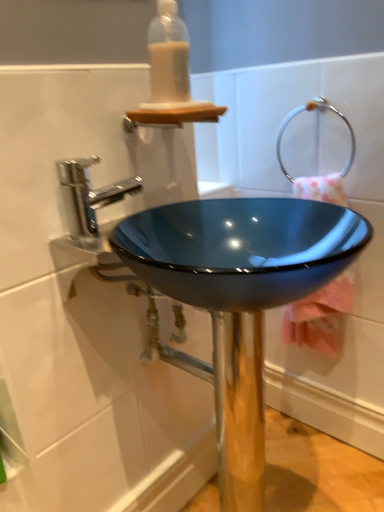
Question: Considering the relative sizes of translucent plastic bottle at upper center and glossy blue bowl at center in the image provided, is translucent plastic bottle at upper center thinner than glossy blue bowl at center?

Choices:
 (A) no
 (B) yes

Answer: (B)

Question: From the image's perspective, is translucent plastic bottle at upper center on glossy blue bowl at center?

Choices:
 (A) yes
 (B) no

Answer: (A)

Question: Would you say translucent plastic bottle at upper center is outside glossy blue bowl at center?

Choices:
 (A) yes
 (B) no

Answer: (A)

Question: Is translucent plastic bottle at upper center oriented towards glossy blue bowl at center?

Choices:
 (A) yes
 (B) no

Answer: (B)

Question: Considering the relative positions of translucent plastic bottle at upper center and glossy blue bowl at center in the image provided, is translucent plastic bottle at upper center to the right of glossy blue bowl at center from the viewer's perspective?

Choices:
 (A) yes
 (B) no

Answer: (B)

Question: From a real-world perspective, relative to polished chrome faucet at upper left, is glossy blue bowl at center vertically above or below?

Choices:
 (A) below
 (B) above

Answer: (A)

Question: In terms of width, does glossy blue bowl at center look wider or thinner when compared to polished chrome faucet at upper left?

Choices:
 (A) wide
 (B) thin

Answer: (A)

Question: From their relative heights in the image, would you say glossy blue bowl at center is taller or shorter than polished chrome faucet at upper left?

Choices:
 (A) tall
 (B) short

Answer: (A)

Question: Considering their positions, is glossy blue bowl at center located in front of or behind polished chrome faucet at upper left?

Choices:
 (A) front
 (B) behind

Answer: (A)

Question: From their relative heights in the image, would you say glossy blue bowl at center is taller or shorter than pink fabric towel at center right?

Choices:
 (A) tall
 (B) short

Answer: (A)

Question: Is glossy blue bowl at center spatially inside pink fabric towel at center right, or outside of it?

Choices:
 (A) inside
 (B) outside

Answer: (B)

Question: From a real-world perspective, is glossy blue bowl at center above or below pink fabric towel at center right?

Choices:
 (A) above
 (B) below

Answer: (B)

Question: Is point pyautogui.click(x=140, y=244) positioned closer to the camera than point pyautogui.click(x=289, y=320)?

Choices:
 (A) farther
 (B) closer

Answer: (B)

Question: Is silver metallic towel ring at upper right in front of or behind glossy blue bowl at center in the image?

Choices:
 (A) behind
 (B) front

Answer: (A)

Question: In terms of width, does silver metallic towel ring at upper right look wider or thinner when compared to glossy blue bowl at center?

Choices:
 (A) wide
 (B) thin

Answer: (B)